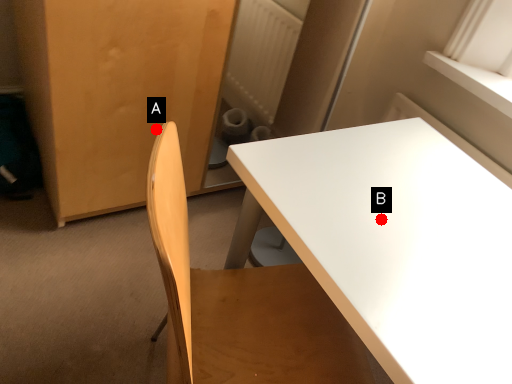
Question: Two points are circled on the image, labeled by A and B beside each circle. Which point appears farthest from the camera in this image?

Choices:
 (A) A is further
 (B) B is further

Answer: (A)